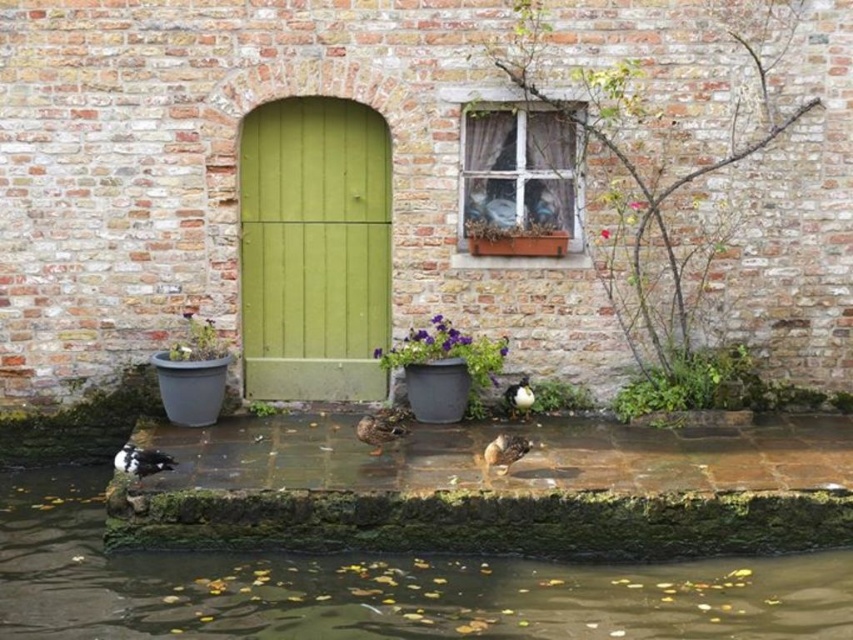
Is green wooden door at center further to camera compared to green matte pot at left?

Yes, it is.

Which is more to the left, green wooden door at center or green matte pot at left?

From the viewer's perspective, green matte pot at left appears more on the left side.

Describe the element at coordinates (312, 250) in the screenshot. I see `green wooden door at center` at that location.

This screenshot has width=853, height=640. Find the location of `green wooden door at center`. green wooden door at center is located at coordinates tap(312, 250).

Between green matte pot at left and brown matte duck at center, which one is positioned lower?

brown matte duck at center is below.

Looking at this image, is green matte pot at left below brown matte duck at center?

No, green matte pot at left is not below brown matte duck at center.

Is point (193, 349) less distant than point (383, 429)?

No, (193, 349) is further to viewer.

Identify the location of green matte pot at left. This screenshot has width=853, height=640. (198, 340).

Looking at this image, does brown mossy water at lower center appear on the left side of white speckled duck at lower left?

No, brown mossy water at lower center is not to the left of white speckled duck at lower left.

Does point (33, 620) come in front of point (149, 472)?

Yes, it is in front of point (149, 472).

What do you see at coordinates (378, 588) in the screenshot? I see `brown mossy water at lower center` at bounding box center [378, 588].

Identify the location of brown mossy water at lower center. This screenshot has width=853, height=640. (378, 588).